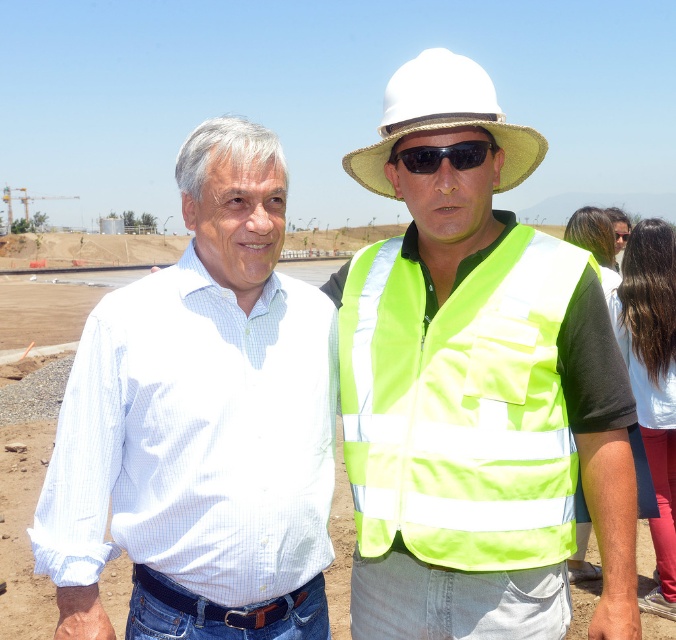
Which is more to the left, reflective yellow vest at center or white straw cowboy hat at upper center?

From the viewer's perspective, reflective yellow vest at center appears more on the left side.

This screenshot has width=676, height=640. Describe the element at coordinates (475, 388) in the screenshot. I see `reflective yellow vest at center` at that location.

Image resolution: width=676 pixels, height=640 pixels. In order to click on reflective yellow vest at center in this screenshot , I will do `click(475, 388)`.

Is reflective yellow vest at center shorter than high-visibility fabric safety vest at center?

Incorrect, reflective yellow vest at center's height does not fall short of high-visibility fabric safety vest at center's.

Is point (535, 412) in front of point (477, 300)?

Yes, it is in front of point (477, 300).

Is point (400, 508) behind point (460, 465)?

Yes, point (400, 508) is behind point (460, 465).

Find the location of a particular element. reflective yellow vest at center is located at coordinates (475, 388).

Does point (468, 339) come closer to viewer compared to point (95, 580)?

No.

Who is shorter, reflective yellow vest at center or white checkered shirt at center?

Standing shorter between the two is white checkered shirt at center.

Identify the location of reflective yellow vest at center. The height and width of the screenshot is (640, 676). pos(475,388).